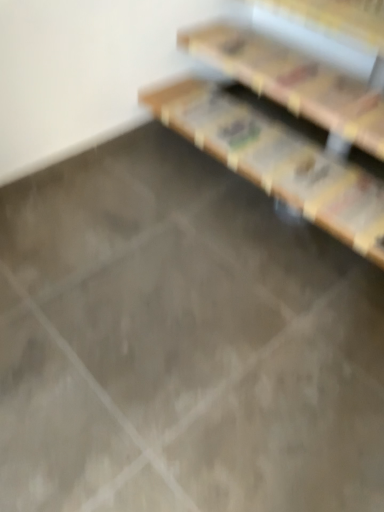
Question: Is wooden at upper right inside or outside of wooden bookshelf at upper right?

Choices:
 (A) outside
 (B) inside

Answer: (A)

Question: Does point (331, 72) appear closer or farther from the camera than point (162, 90)?

Choices:
 (A) farther
 (B) closer

Answer: (B)

Question: Is wooden at upper right bigger or smaller than wooden bookshelf at upper right?

Choices:
 (A) small
 (B) big

Answer: (A)

Question: Is wooden bookshelf at upper right wider or thinner than wooden at upper right?

Choices:
 (A) wide
 (B) thin

Answer: (A)

Question: Considering the positions of wooden bookshelf at upper right and wooden at upper right in the image, is wooden bookshelf at upper right taller or shorter than wooden at upper right?

Choices:
 (A) tall
 (B) short

Answer: (A)

Question: In the image, is wooden bookshelf at upper right positioned in front of or behind wooden at upper right?

Choices:
 (A) behind
 (B) front

Answer: (B)

Question: Choose the correct answer: Is wooden bookshelf at upper right inside wooden at upper right or outside it?

Choices:
 (A) outside
 (B) inside

Answer: (A)